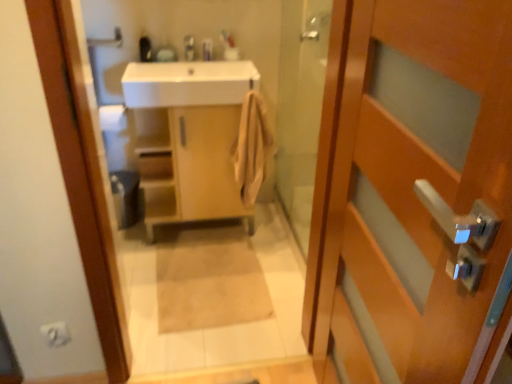
Question: From a real-world perspective, is beige fabric bath mat at center physically located above or below white matte toilet paper at lower left?

Choices:
 (A) below
 (B) above

Answer: (A)

Question: In the image, is beige fabric bath mat at center positioned in front of or behind white matte toilet paper at lower left?

Choices:
 (A) behind
 (B) front

Answer: (A)

Question: Estimate the real-world distances between objects in this image. Which object is farther from the matte plastic toothbrush at upper center?

Choices:
 (A) light wood cabinet at center
 (B) white matte toilet paper at lower left
 (C) matte silver faucet at upper center
 (D) beige fabric bath mat at center
 (E) wooden door at right

Answer: (E)

Question: Estimate the real-world distances between objects in this image. Which object is farther from the white glossy sink at upper center?

Choices:
 (A) beige cotton towel at center
 (B) matte wooden mirror at upper center
 (C) wooden door at right
 (D) matte silver faucet at upper center
 (E) white matte toilet paper at lower left

Answer: (E)